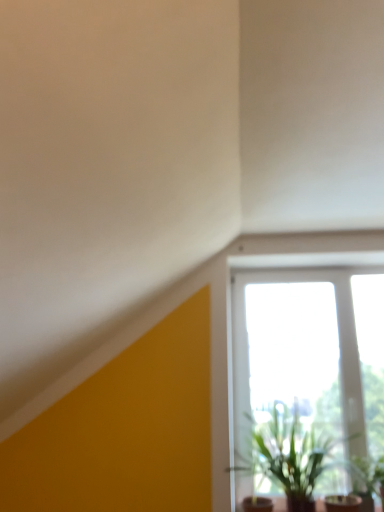
Question: From the image's perspective, does transparent glass window at center appear higher than green leafy plant at lower right, the 2th houseplant from the left?

Choices:
 (A) no
 (B) yes

Answer: (B)

Question: Is transparent glass window at center smaller than green leafy plant at lower right, which is the first houseplant from right to left?

Choices:
 (A) yes
 (B) no

Answer: (B)

Question: Is transparent glass window at center oriented towards green leafy plant at lower right, the 2th houseplant from the left?

Choices:
 (A) no
 (B) yes

Answer: (B)

Question: Considering the relative positions of transparent glass window at center and green leafy plant at lower right, the 2th houseplant from the left, in the image provided, is transparent glass window at center behind green leafy plant at lower right, the 2th houseplant from the left,?

Choices:
 (A) no
 (B) yes

Answer: (B)

Question: Is transparent glass window at center at the left side of green leafy plant at lower right, the 2th houseplant from the left?

Choices:
 (A) no
 (B) yes

Answer: (B)

Question: Is transparent glass window at center bigger than green leafy plant at lower right, the 2th houseplant from the left?

Choices:
 (A) yes
 (B) no

Answer: (A)

Question: Does transparent glass window at center have a lesser width compared to green leafy plant at lower right, marked as the second houseplant in a right-to-left arrangement?

Choices:
 (A) yes
 (B) no

Answer: (A)

Question: From the image's perspective, would you say transparent glass window at center is positioned over green leafy plant at lower right, the 1th houseplant from the left?

Choices:
 (A) yes
 (B) no

Answer: (A)

Question: Is transparent glass window at center far away from green leafy plant at lower right, marked as the second houseplant in a right-to-left arrangement?

Choices:
 (A) no
 (B) yes

Answer: (A)

Question: Does transparent glass window at center lie in front of green leafy plant at lower right, the 1th houseplant from the left?

Choices:
 (A) yes
 (B) no

Answer: (B)

Question: Could green leafy plant at lower right, the 1th houseplant from the left, be considered to be inside transparent glass window at center?

Choices:
 (A) yes
 (B) no

Answer: (B)

Question: Is transparent glass window at center to the left of green leafy plant at lower right, marked as the second houseplant in a right-to-left arrangement, from the viewer's perspective?

Choices:
 (A) no
 (B) yes

Answer: (A)

Question: Considering the relative sizes of green leafy plant at lower right, the 2th houseplant from the left, and transparent glass window at center in the image provided, is green leafy plant at lower right, the 2th houseplant from the left, wider than transparent glass window at center?

Choices:
 (A) yes
 (B) no

Answer: (A)